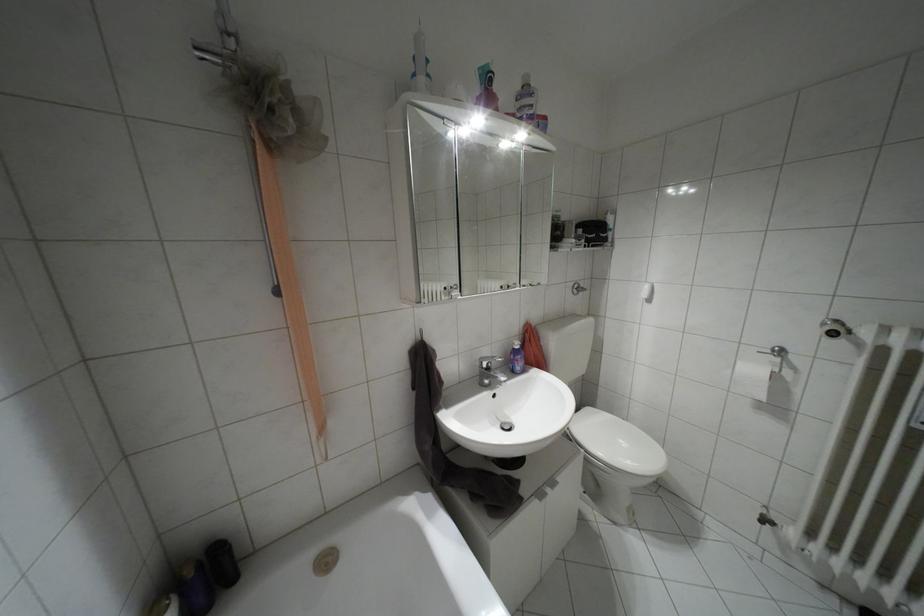
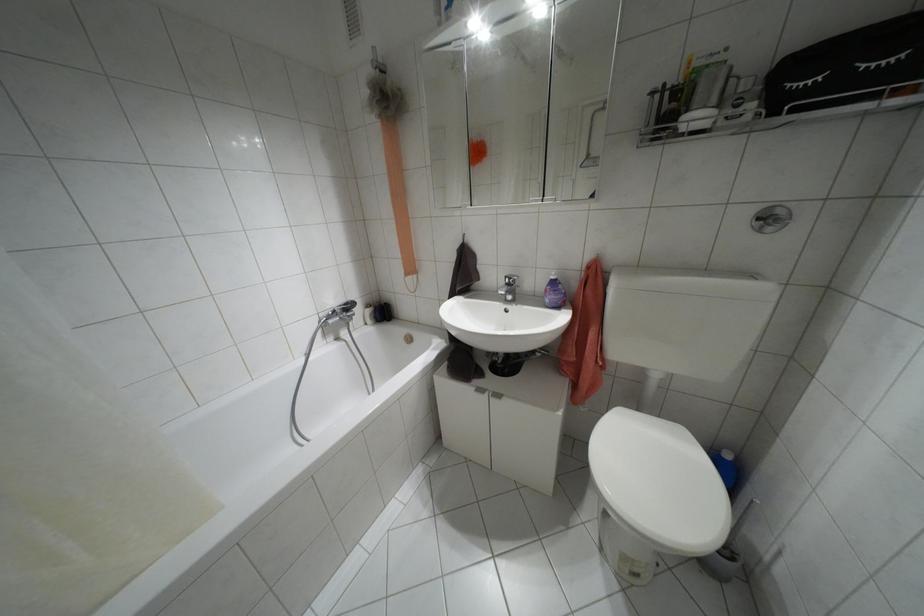
Where in the second image is the point corresponding to the point at 488,368 from the first image?

(507, 284)